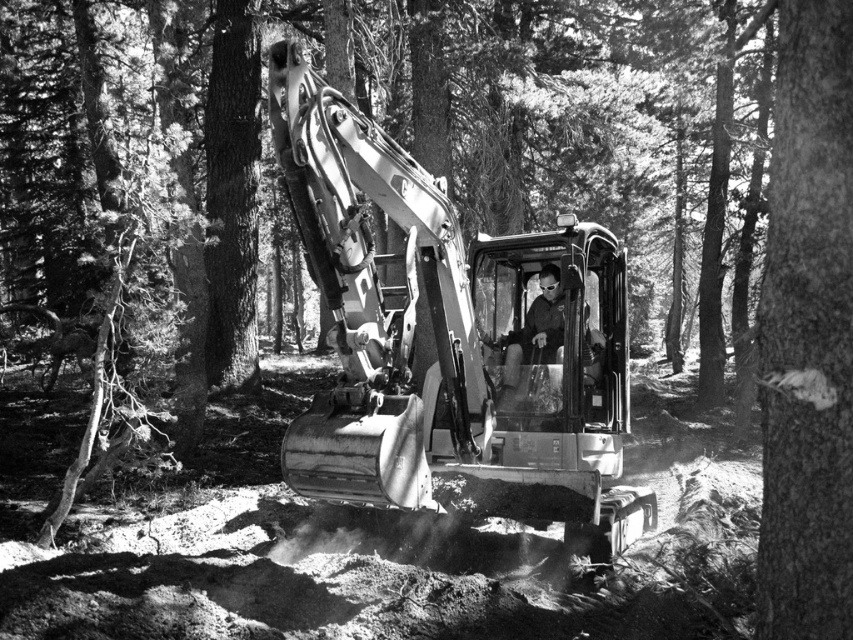
Question: Can you confirm if smooth bark tree at center right is positioned to the left of matte black helmet at center?

Choices:
 (A) no
 (B) yes

Answer: (A)

Question: Can you confirm if metallic gray excavator at center is positioned to the left of smooth bark tree at center right?

Choices:
 (A) no
 (B) yes

Answer: (B)

Question: Which point is farther to the camera?

Choices:
 (A) matte black helmet at center
 (B) smooth bark tree at center right

Answer: (A)

Question: Which object is the closest to the metallic gray excavator at center?

Choices:
 (A) smooth bark tree at center right
 (B) matte black helmet at center

Answer: (B)

Question: Which of the following is the farthest from the observer?

Choices:
 (A) metallic gray excavator at center
 (B) matte black helmet at center
 (C) smooth bark tree at center right

Answer: (B)

Question: Is smooth bark tree at center right wider than matte black helmet at center?

Choices:
 (A) yes
 (B) no

Answer: (B)